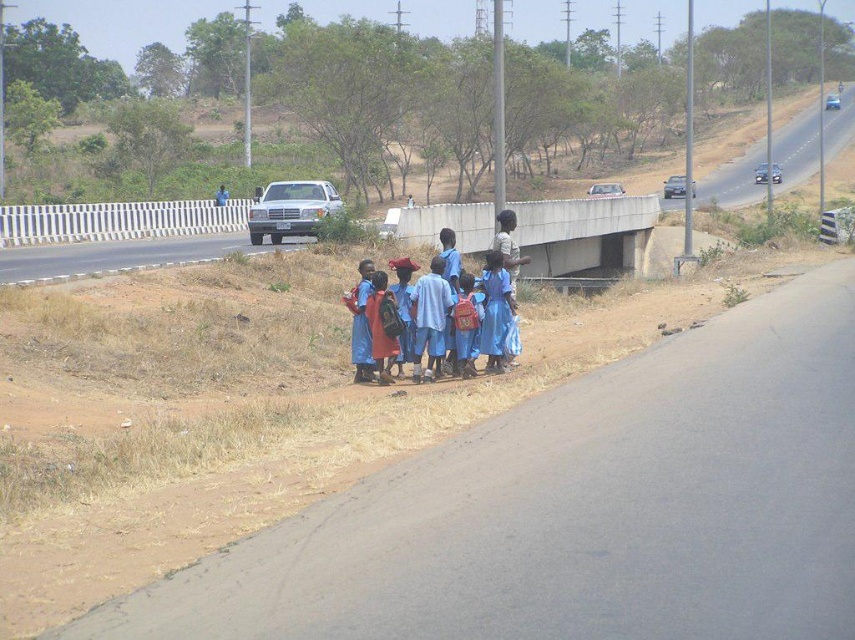
Question: Which object appears closest to the camera in this image?

Choices:
 (A) blue fabric backpack at center
 (B) matte red backpack at center
 (C) brown asphalt highway at lower center
 (D) asphalt road at upper right

Answer: (C)

Question: Does brown asphalt highway at lower center have a greater width compared to concrete at center?

Choices:
 (A) no
 (B) yes

Answer: (A)

Question: Based on their relative distances, which object is nearer to the matte red backpack at center?

Choices:
 (A) blue fabric backpack at center
 (B) brown asphalt highway at lower center

Answer: (A)

Question: Can you confirm if concrete at center is bigger than asphalt road at upper right?

Choices:
 (A) no
 (B) yes

Answer: (A)

Question: Which of the following is the farthest from the observer?

Choices:
 (A) concrete at center
 (B) blue fabric backpack at center

Answer: (A)

Question: Does brown asphalt highway at lower center have a greater width compared to asphalt road at upper right?

Choices:
 (A) no
 (B) yes

Answer: (A)